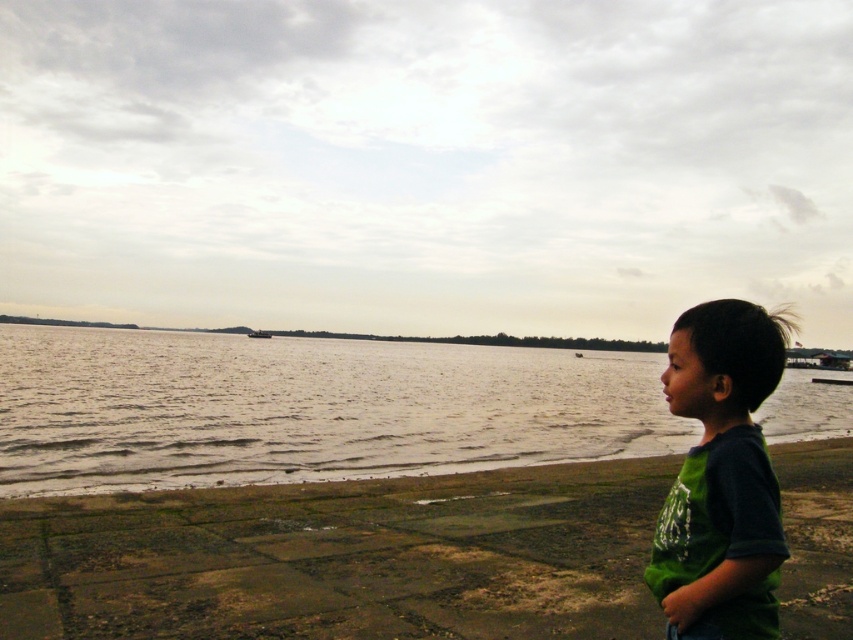
You are a photographer trying to capture the smooth concrete beach at lower right and the dark gray metallic boat at center in the same frame. Based on their positions, which object should you focus on first to ensure both are in the shot?

The smooth concrete beach at lower right is taller than the dark gray metallic boat at center, so you should focus on the smooth concrete beach at lower right first to ensure both are in the shot.

You are a photographer trying to capture the reflection of the dark gray metallic boat at center in the grayish water at lower left. Based on the scene description, can you confirm if the boat is positioned above the water where its reflection would appear?

The grayish water at lower left is below the dark gray metallic boat at center, so the boat is positioned above the water, allowing its reflection to appear in the water.

You are a photographer trying to capture a shot of the dark gray metallic boat at center. You notice the green cotton shirt at lower right is blocking part of the boat. Which object should you move to get a clear view of the boat?

The green cotton shirt at lower right has a greater height compared to dark gray metallic boat at center, so you should move the green cotton shirt at lower right to get a clear view of the boat.